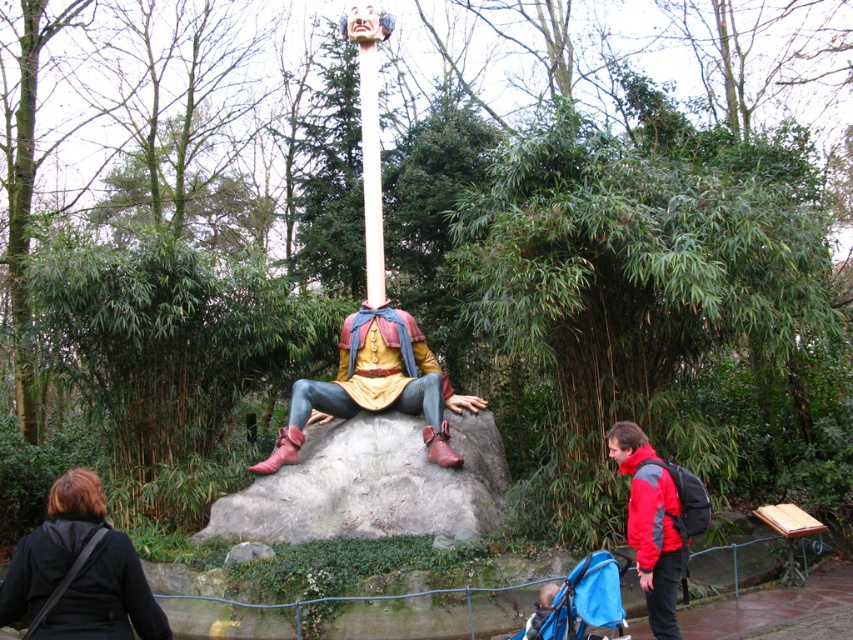
Does red jacket at lower right appear on the right side of white smooth pole at center?

Yes, red jacket at lower right is to the right of white smooth pole at center.

Is red jacket at lower right shorter than white smooth pole at center?

No.

Does point (612, 436) come closer to viewer compared to point (361, 60)?

Yes, it is.

Identify the location of red jacket at lower right. This screenshot has height=640, width=853. (650, 524).

Which is below, matte painted wood figure at center or white smooth pole at center?

matte painted wood figure at center is lower down.

Is matte painted wood figure at center smaller than white smooth pole at center?

Actually, matte painted wood figure at center might be larger than white smooth pole at center.

Does point (482, 404) lie behind point (376, 84)?

No, (482, 404) is in front of (376, 84).

At what (x,y) coordinates should I click in order to perform the action: click on matte painted wood figure at center. Please return your answer as a coordinate pair (x, y). The image size is (853, 640). Looking at the image, I should click on (376, 385).

Can you confirm if matte painted wood figure at center is positioned to the left of red jacket at lower right?

Indeed, matte painted wood figure at center is positioned on the left side of red jacket at lower right.

Can you confirm if matte painted wood figure at center is thinner than red jacket at lower right?

No, matte painted wood figure at center is not thinner than red jacket at lower right.

Does point (386, 372) come closer to viewer compared to point (619, 449)?

No, it is behind (619, 449).

Find the location of a particular element. matte painted wood figure at center is located at coordinates (x=376, y=385).